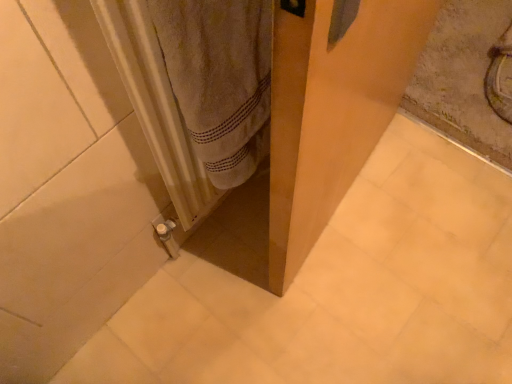
The height and width of the screenshot is (384, 512). Find the location of `transparent plastic screen door at center`. transparent plastic screen door at center is located at coordinates (331, 113).

Image resolution: width=512 pixels, height=384 pixels. What do you see at coordinates (331, 113) in the screenshot?
I see `transparent plastic screen door at center` at bounding box center [331, 113].

Identify the location of white textured radiator at lower left. Image resolution: width=512 pixels, height=384 pixels. (156, 106).

Image resolution: width=512 pixels, height=384 pixels. Describe the element at coordinates (156, 106) in the screenshot. I see `white textured radiator at lower left` at that location.

Where is `transparent plastic screen door at center`? The height and width of the screenshot is (384, 512). transparent plastic screen door at center is located at coordinates (331, 113).

Can you confirm if white textured radiator at lower left is positioned to the left of transparent plastic screen door at center?

Indeed, white textured radiator at lower left is positioned on the left side of transparent plastic screen door at center.

Does white textured radiator at lower left come behind transparent plastic screen door at center?

Yes, the depth of white textured radiator at lower left is greater than that of transparent plastic screen door at center.

Which is closer, [168,168] or [341,175]?

Clearly, point [168,168] is closer to the camera than point [341,175].

From the image's perspective, is white textured radiator at lower left on top of transparent plastic screen door at center?

No.

From a real-world perspective, is white textured radiator at lower left physically located above or below transparent plastic screen door at center?

white textured radiator at lower left is above transparent plastic screen door at center.

In the scene shown: Between white textured radiator at lower left and transparent plastic screen door at center, which one has larger width?

transparent plastic screen door at center is wider.

Considering the sizes of white textured radiator at lower left and transparent plastic screen door at center in the image, is white textured radiator at lower left taller or shorter than transparent plastic screen door at center?

In the image, white textured radiator at lower left appears to be shorter than transparent plastic screen door at center.

Does white textured radiator at lower left have a smaller size compared to transparent plastic screen door at center?

Yes, white textured radiator at lower left is smaller than transparent plastic screen door at center.

Is white textured radiator at lower left not within transparent plastic screen door at center?

Absolutely, white textured radiator at lower left is external to transparent plastic screen door at center.

Is white textured radiator at lower left next to transparent plastic screen door at center?

No, white textured radiator at lower left is not touching transparent plastic screen door at center.

Is transparent plastic screen door at center at the back of white textured radiator at lower left?

white textured radiator at lower left does not have its back to transparent plastic screen door at center.

This screenshot has width=512, height=384. I want to click on radiator lying behind the transparent plastic screen door at center, so click(x=156, y=106).

Considering the relative positions of transparent plastic screen door at center and white textured radiator at lower left in the image provided, is transparent plastic screen door at center to the right of white textured radiator at lower left from the viewer's perspective?

Correct, you'll find transparent plastic screen door at center to the right of white textured radiator at lower left.

Which is in front, transparent plastic screen door at center or white textured radiator at lower left?

Positioned in front is transparent plastic screen door at center.

Which is closer, [300,24] or [155,42]?

The point [300,24] is closer.

From the image's perspective, which one is positioned lower, transparent plastic screen door at center or white textured radiator at lower left?

white textured radiator at lower left, from the image's perspective.

From a real-world perspective, who is located higher, transparent plastic screen door at center or white textured radiator at lower left?

white textured radiator at lower left is physically above.

Between transparent plastic screen door at center and white textured radiator at lower left, which one has smaller width?

With smaller width is white textured radiator at lower left.

Looking at this image, can you confirm if transparent plastic screen door at center is shorter than white textured radiator at lower left?

No.

Looking at the image, does transparent plastic screen door at center seem bigger or smaller compared to white textured radiator at lower left?

Clearly, transparent plastic screen door at center is larger in size than white textured radiator at lower left.

Based on the photo, is white textured radiator at lower left surrounded by transparent plastic screen door at center?

No, transparent plastic screen door at center does not contain white textured radiator at lower left.

Is the surface of transparent plastic screen door at center in direct contact with white textured radiator at lower left?

No, transparent plastic screen door at center is not making contact with white textured radiator at lower left.

Is white textured radiator at lower left at the back of transparent plastic screen door at center?

Absolutely, transparent plastic screen door at center is directed away from white textured radiator at lower left.

How different are the orientations of transparent plastic screen door at center and white textured radiator at lower left in degrees?

They differ by 8.94 degrees in their facing directions.

How distant is transparent plastic screen door at center from white textured radiator at lower left?

transparent plastic screen door at center and white textured radiator at lower left are 11.15 inches apart.

The width and height of the screenshot is (512, 384). I want to click on screen door that appears in front of the white textured radiator at lower left, so click(331, 113).

Image resolution: width=512 pixels, height=384 pixels. Identify the location of radiator behind the transparent plastic screen door at center. (156, 106).

Where is `radiator located below the transparent plastic screen door at center (from the image's perspective)`? This screenshot has height=384, width=512. radiator located below the transparent plastic screen door at center (from the image's perspective) is located at coordinates (156, 106).